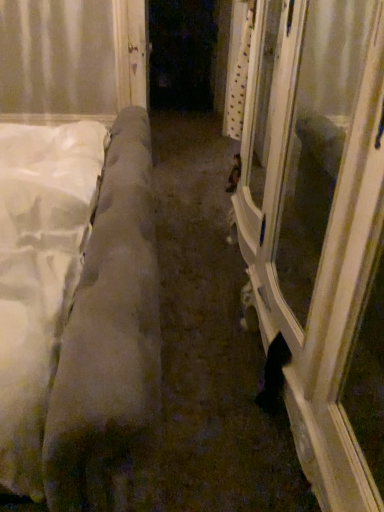
Question: Is white glossy door at center wider or thinner than white soft mattress at left?

Choices:
 (A) thin
 (B) wide

Answer: (A)

Question: Is point (134, 94) positioned closer to the camera than point (145, 407)?

Choices:
 (A) closer
 (B) farther

Answer: (B)

Question: Which is farther from the white soft mattress at left?

Choices:
 (A) white glossy door at center
 (B) white glossy door at center

Answer: (A)

Question: Which object is positioned closest to the white soft mattress at left?

Choices:
 (A) white glossy door at center
 (B) white glossy door at center

Answer: (A)